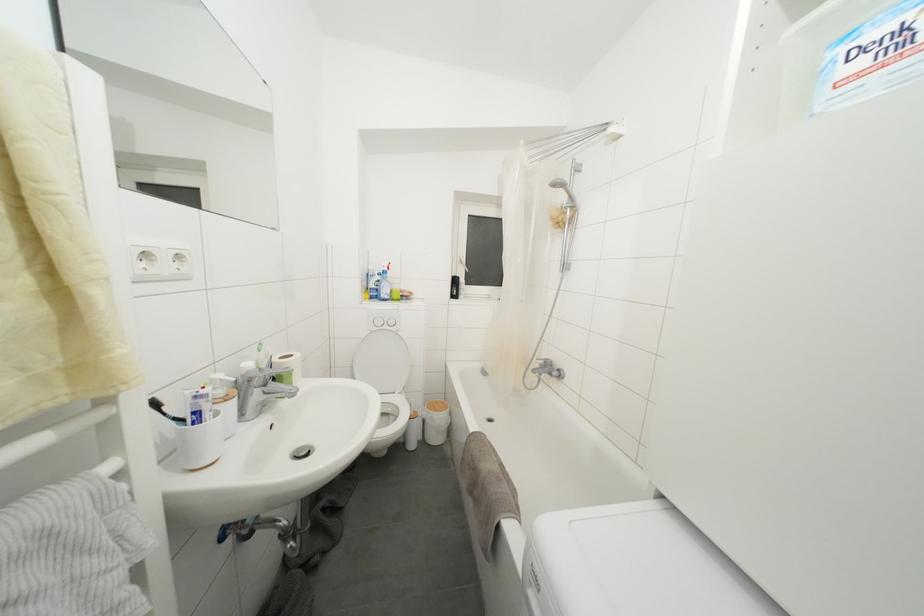
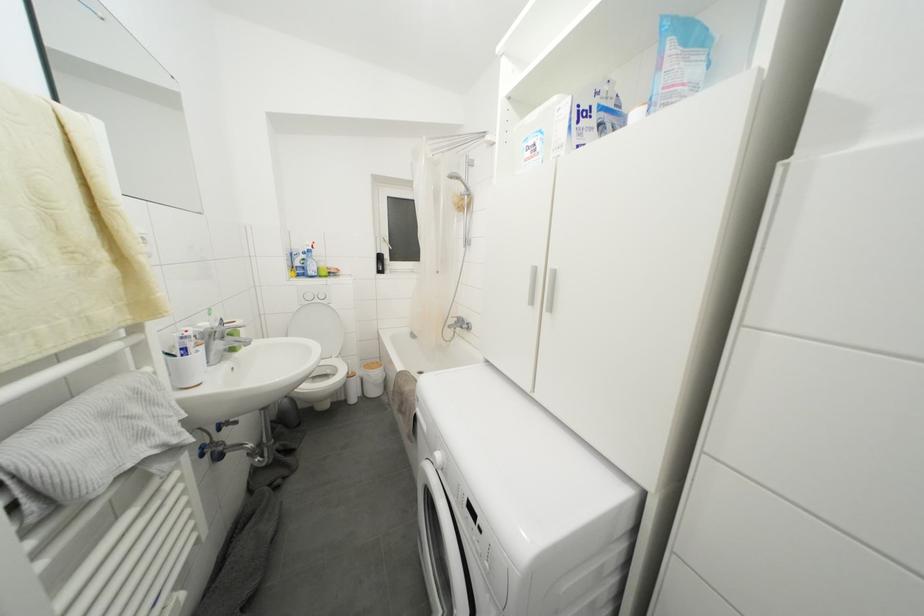
Locate, in the second image, the point that corresponds to (x=382, y=286) in the first image.

(308, 264)